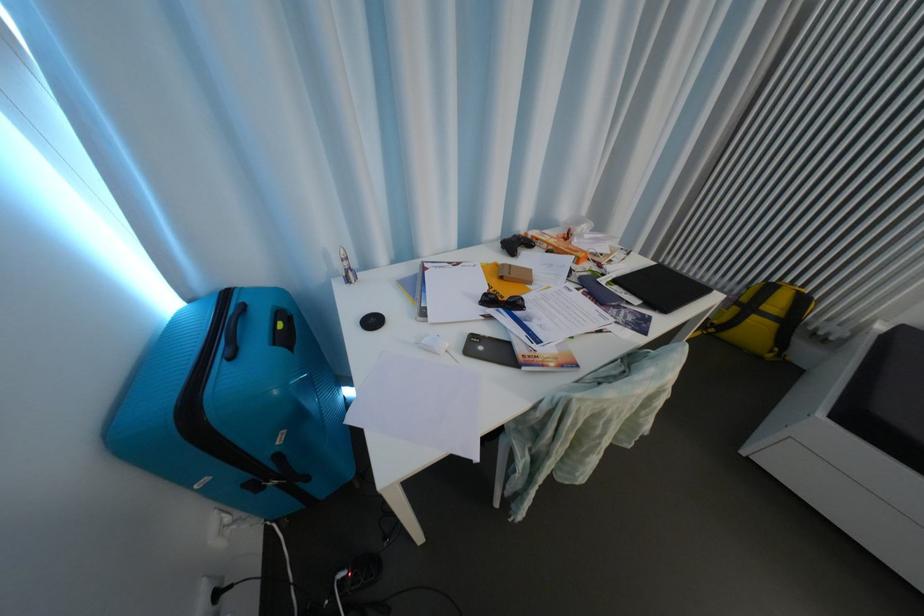
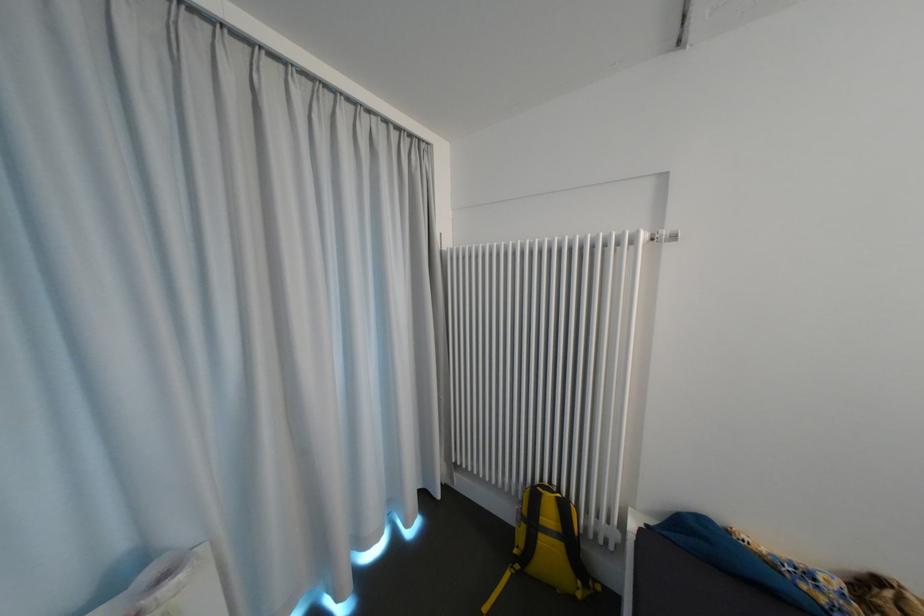
The point at (792, 355) is marked in the first image. Where is the corresponding point in the second image?

(599, 586)